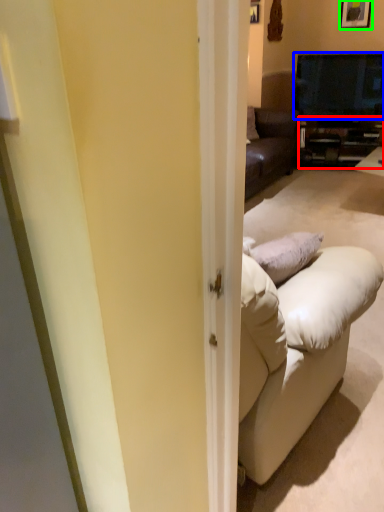
Question: Estimate the real-world distances between objects in this image. Which object is closer to cabinetry (highlighted by a red box), television (highlighted by a blue box) or picture frame (highlighted by a green box)?

Choices:
 (A) television
 (B) picture frame

Answer: (A)